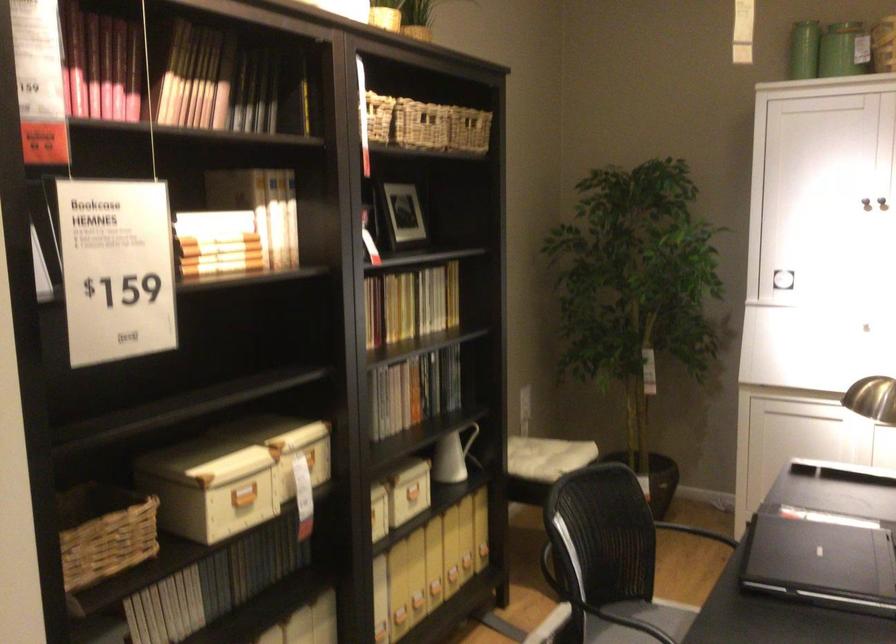
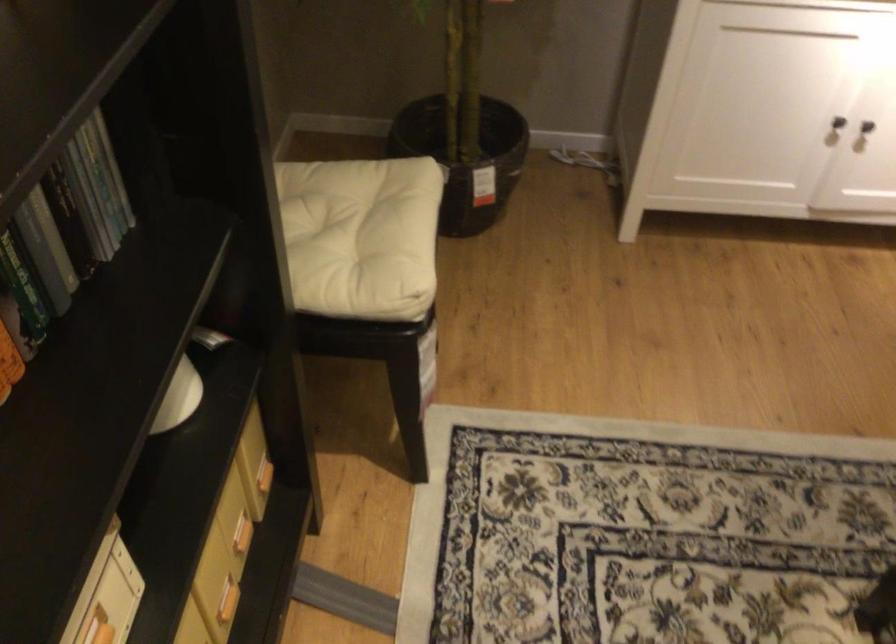
In the second image, find the point that corresponds to point 547,460 in the first image.

(355, 234)